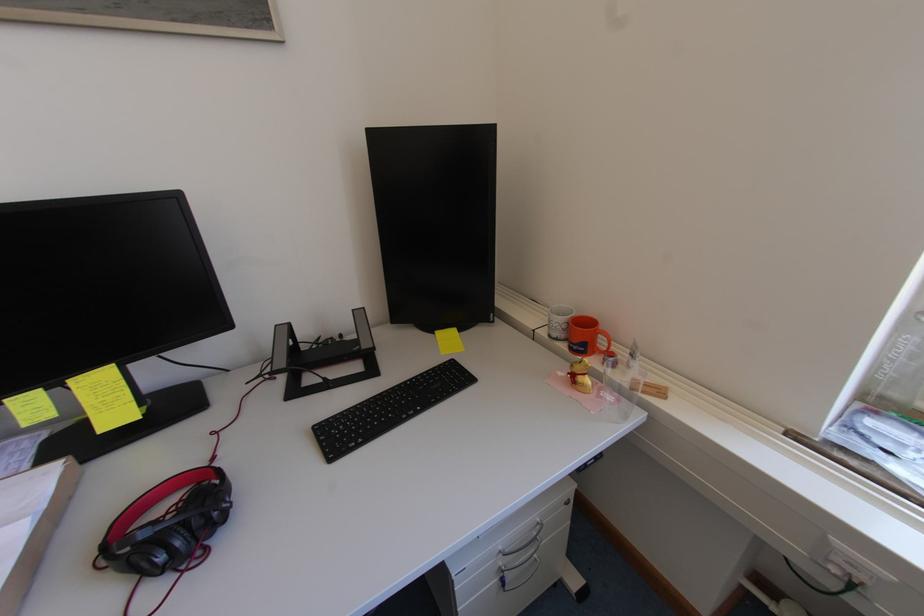
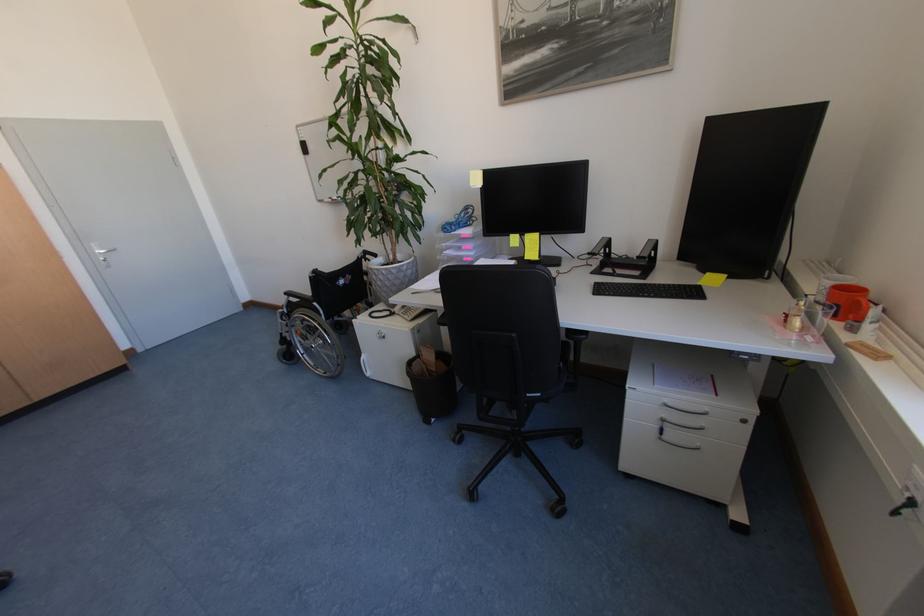
Locate, in the second image, the point that corresponds to (x=236, y=371) in the first image.

(581, 259)